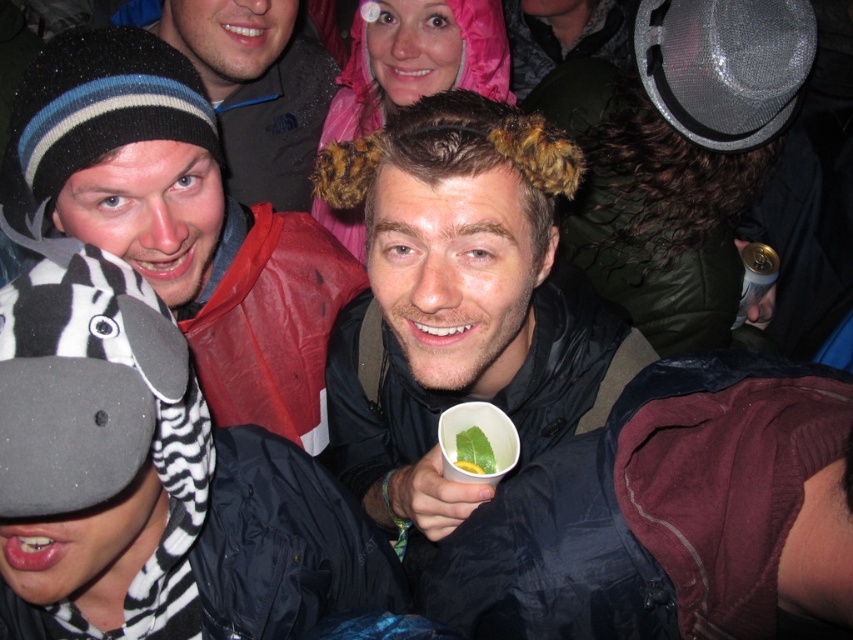
You are at a social gathering and notice two items at the center of the scene. Which item is positioned to the right when looking at the fuzzy brown hat at center and the green leafy vegetable at center?

The fuzzy brown hat at center is positioned to the right of the green leafy vegetable at center.